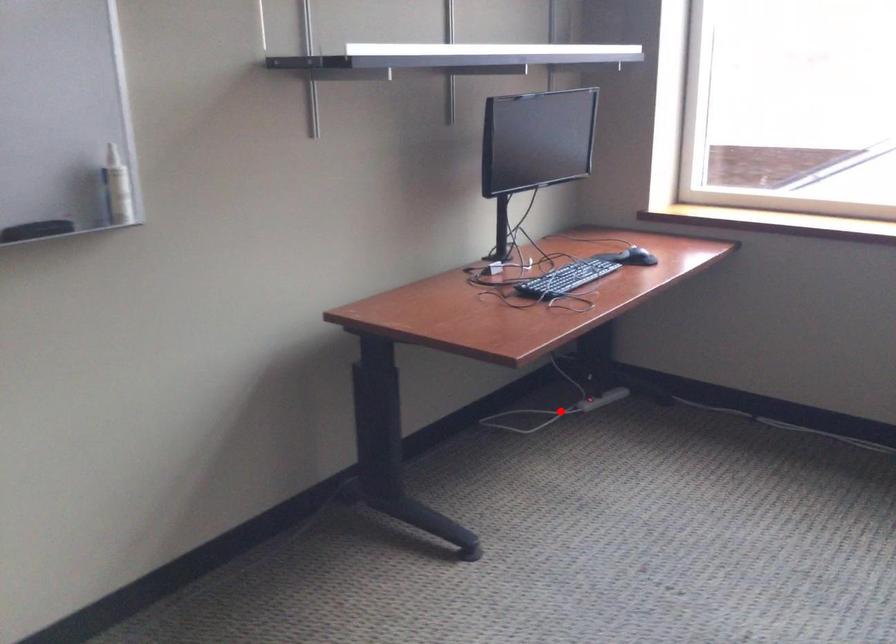
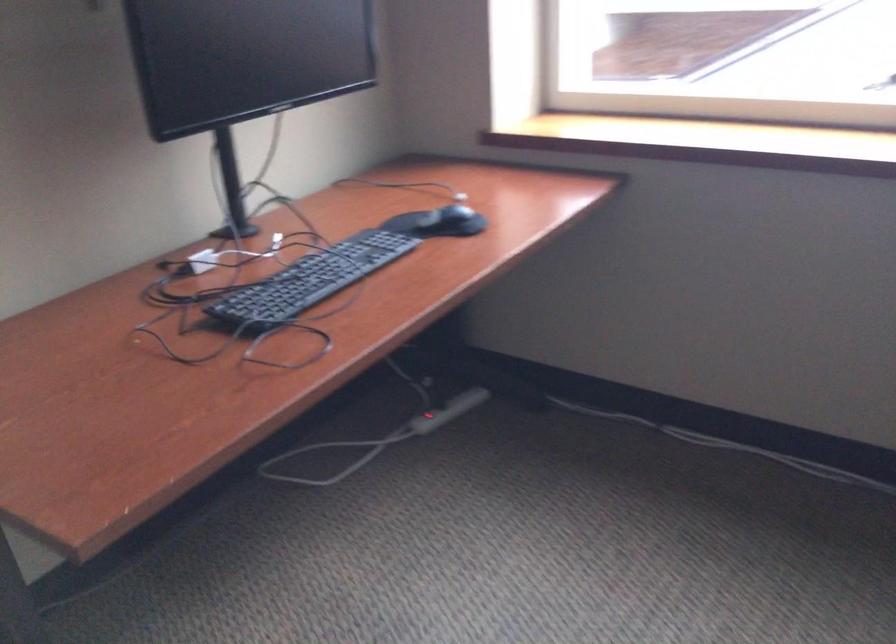
Question: I am providing you with two images of the same scene from different viewpoints. Given a red point in image1, look at the same physical point in image2. Is it:

Choices:
 (A) Closer to the viewpoint
 (B) Farther from the viewpoint

Answer: (A)